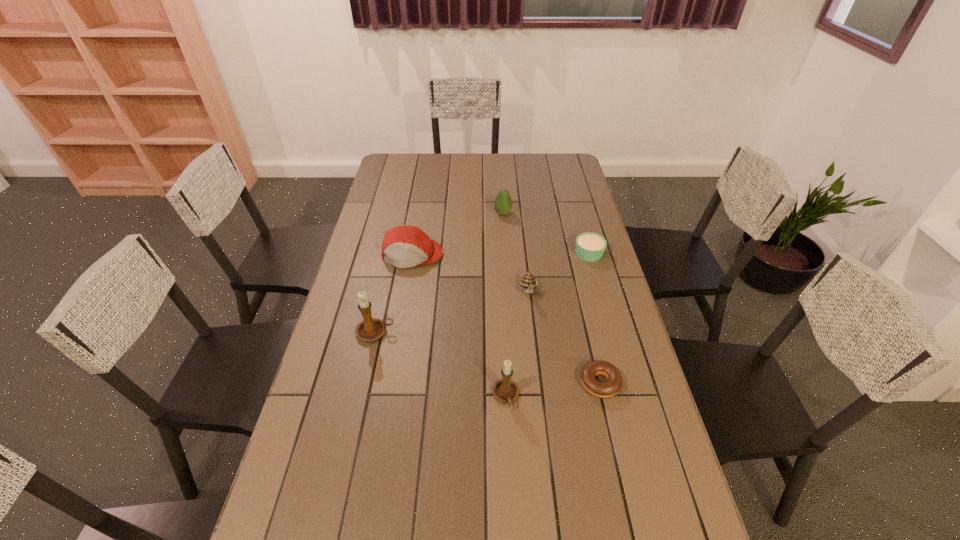
Locate an element on the screen. doughnut that is at the right edge is located at coordinates (607, 389).

The image size is (960, 540). What are the coordinates of `blank space at the far edge` in the screenshot? It's located at (508, 173).

Find the location of a particular element. This screenshot has width=960, height=540. vacant position at the near edge of the desktop is located at coordinates coord(446,526).

I want to click on vacant space at the left edge, so click(352, 381).

Locate an element on the screen. The width and height of the screenshot is (960, 540). vacant space at the right edge of the desktop is located at coordinates (634, 437).

What are the coordinates of `vacant space at the far left corner of the desktop` in the screenshot? It's located at (383, 171).

Locate an element on the screen. This screenshot has height=540, width=960. vacant position at the far right corner of the desktop is located at coordinates (564, 170).

Find the location of a particular element. This screenshot has width=960, height=540. empty space that is in between the avocado and the cap is located at coordinates (457, 234).

Locate an element on the screen. This screenshot has height=540, width=960. vacant area that lies between the taller candle holder and the cap is located at coordinates (394, 294).

Where is `empty location between the farthest object and the snail`? empty location between the farthest object and the snail is located at coordinates (516, 253).